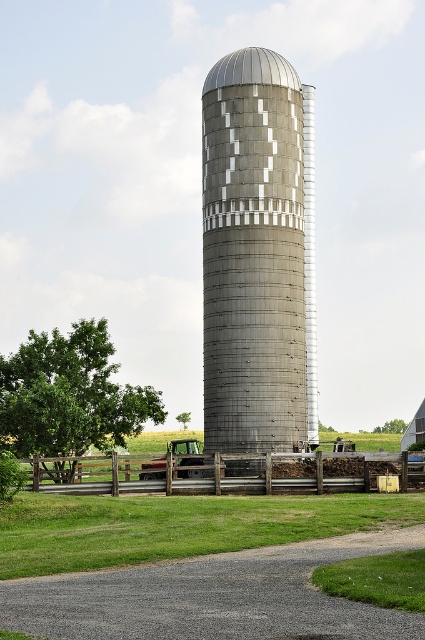
You are a farmer who needs to move a 12 meter long bale of hay from the barn to the storage area. The path between the gray metallic silo at center and the wooden fence at lower center is your only route. Can your bale of hay pass through this path without any issues?

The distance between the gray metallic silo at center and the wooden fence at lower center is 14.10 meters, which is wider than the 12 meter long bale of hay. Therefore, the bale can pass through the path without any issues.

You are standing in the farmyard and want to take a photo of the gray metallic silo at center and the wooden fence at lower center. If you want the silo to appear larger in the photo than the fence, where should you position yourself relative to them?

You should position yourself closer to the gray metallic silo at center because it is taller than the wooden fence at lower center, so being closer will make it appear larger in the photo.

You are standing at point [424,477] and want to walk to the large cylindrical silo in the center. Is the point [292,99] between you and the silo?

Point [292,99] is behind point [424,477], so it is not between you and the silo. You can walk directly to the silo without obstruction from point [292,99].